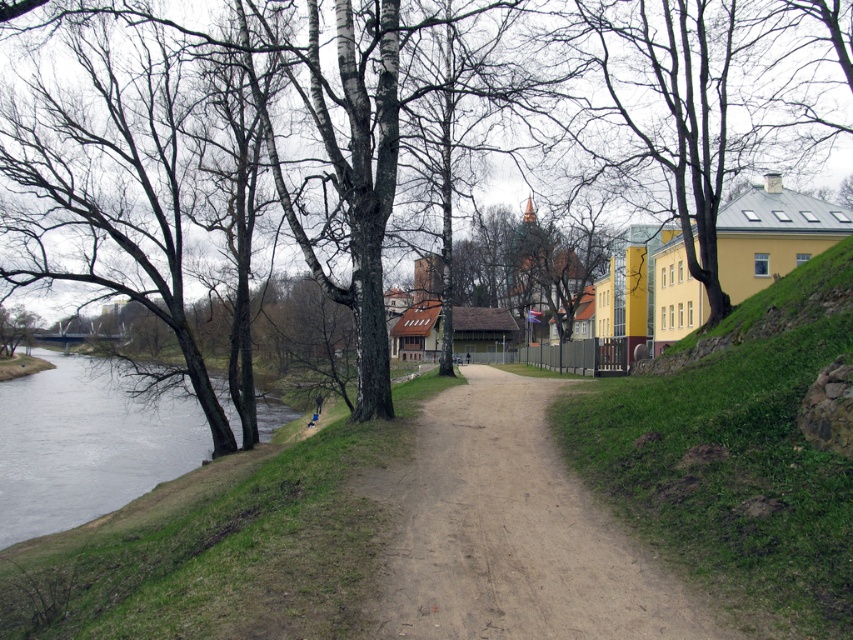
Question: Considering the real-world distances, which object is closest to the brown sandy dirt track at center?

Choices:
 (A) brown bark tree at left
 (B) gray water at lower left

Answer: (A)

Question: Does brown bark tree at left have a smaller size compared to brown sandy dirt track at center?

Choices:
 (A) no
 (B) yes

Answer: (A)

Question: Which point appears farthest from the camera in this image?

Choices:
 (A) (474, 468)
 (B) (181, 444)
 (C) (376, 13)

Answer: (B)

Question: Does brown bark tree at left lie in front of gray water at lower left?

Choices:
 (A) no
 (B) yes

Answer: (B)

Question: Which point is farther to the camera?

Choices:
 (A) (77, 474)
 (B) (534, 449)

Answer: (A)

Question: Can you confirm if brown bark tree at left is smaller than gray water at lower left?

Choices:
 (A) no
 (B) yes

Answer: (A)